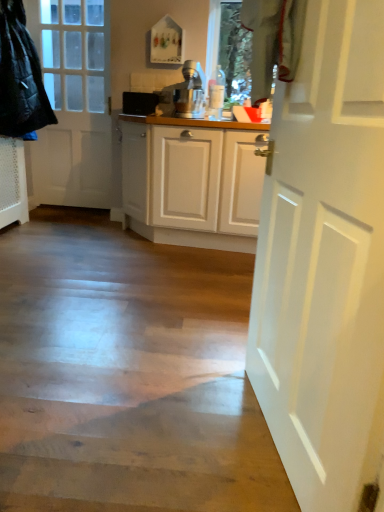
Locate an element on the screen. vacant area to the left of white matte door at right, which is the second door from back to front is located at coordinates (159, 430).